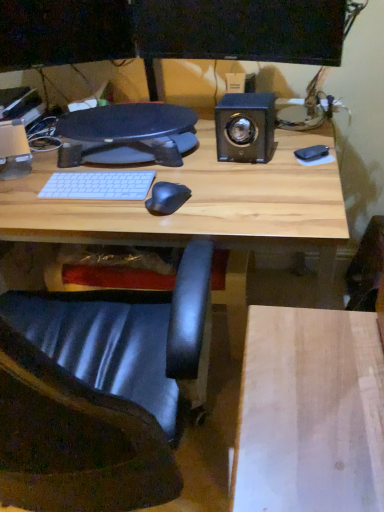
At what (x,y) coordinates should I click in order to perform the action: click on black leather chair at lower left. Please return your answer as a coordinate pair (x, y). Looking at the image, I should click on (99, 394).

What do you see at coordinates (99, 394) in the screenshot? This screenshot has height=512, width=384. I see `black leather chair at lower left` at bounding box center [99, 394].

Consider the image. What is the approximate width of black leather chair at lower left?

27.32 inches.

Locate an element on the screen. metallic black speaker at upper right is located at coordinates (245, 127).

This screenshot has width=384, height=512. Describe the element at coordinates (245, 127) in the screenshot. I see `metallic black speaker at upper right` at that location.

In order to face metallic black speaker at upper right, should I rotate leftwards or rightwards?

A 6.990 degree turn to the right will do.

This screenshot has width=384, height=512. What are the coordinates of `black leather chair at lower left` in the screenshot? It's located at (99, 394).

Is metallic black speaker at upper right to the right of black leather chair at lower left from the viewer's perspective?

Correct, you'll find metallic black speaker at upper right to the right of black leather chair at lower left.

Between metallic black speaker at upper right and black leather chair at lower left, which one is positioned behind?

metallic black speaker at upper right is behind.

Considering the positions of point (274, 101) and point (109, 367), is point (274, 101) closer or farther from the camera than point (109, 367)?

Point (274, 101) is positioned farther from the camera compared to point (109, 367).

From the image's perspective, which is below, metallic black speaker at upper right or black leather chair at lower left?

black leather chair at lower left, from the image's perspective.

In the scene shown: From a real-world perspective, which is physically below, metallic black speaker at upper right or black leather chair at lower left?

black leather chair at lower left.

Is metallic black speaker at upper right wider or thinner than black leather chair at lower left?

Considering their sizes, metallic black speaker at upper right looks slimmer than black leather chair at lower left.

Between metallic black speaker at upper right and black leather chair at lower left, which one has more height?

black leather chair at lower left is taller.

Is metallic black speaker at upper right bigger or smaller than black leather chair at lower left?

Considering their sizes, metallic black speaker at upper right takes up less space than black leather chair at lower left.

Is metallic black speaker at upper right located outside black leather chair at lower left?

metallic black speaker at upper right is positioned outside black leather chair at lower left.

Is metallic black speaker at upper right with black leather chair at lower left?

No, metallic black speaker at upper right is not beside black leather chair at lower left.

Is metallic black speaker at upper right looking in the opposite direction of black leather chair at lower left?

No.

The height and width of the screenshot is (512, 384). I want to click on chair that is below the metallic black speaker at upper right (from the image's perspective), so click(x=99, y=394).

Based on their positions, is black leather chair at lower left located to the left or right of metallic black speaker at upper right?

Clearly, black leather chair at lower left is on the left of metallic black speaker at upper right in the image.

Which is in front, black leather chair at lower left or metallic black speaker at upper right?

Positioned in front is black leather chair at lower left.

Does point (142, 445) appear closer or farther from the camera than point (270, 122)?

Point (142, 445) is closer to the camera than point (270, 122).

From the image's perspective, relative to metallic black speaker at upper right, is black leather chair at lower left above or below?

Based on their image positions, black leather chair at lower left is located beneath metallic black speaker at upper right.

From a real-world perspective, which is physically above, black leather chair at lower left or metallic black speaker at upper right?

metallic black speaker at upper right.

Considering the sizes of objects black leather chair at lower left and metallic black speaker at upper right in the image provided, who is wider, black leather chair at lower left or metallic black speaker at upper right?

Wider between the two is black leather chair at lower left.

Can you confirm if black leather chair at lower left is taller than metallic black speaker at upper right?

Yes, black leather chair at lower left is taller than metallic black speaker at upper right.

Can you confirm if black leather chair at lower left is bigger than metallic black speaker at upper right?

Indeed, black leather chair at lower left has a larger size compared to metallic black speaker at upper right.

Is black leather chair at lower left completely or partially outside of metallic black speaker at upper right?

black leather chair at lower left lies outside metallic black speaker at upper right's area.

Is black leather chair at lower left placed right next to metallic black speaker at upper right?

No, black leather chair at lower left is not beside metallic black speaker at upper right.

Is black leather chair at lower left facing towards metallic black speaker at upper right?

Yes, black leather chair at lower left is facing metallic black speaker at upper right.

How different are the orientations of black leather chair at lower left and metallic black speaker at upper right in degrees?

There is a 170-degree angle between the facing directions of black leather chair at lower left and metallic black speaker at upper right.

This screenshot has height=512, width=384. I want to click on chair on the left side of metallic black speaker at upper right, so click(99, 394).

At what (x,y) coordinates should I click in order to perform the action: click on chair below the metallic black speaker at upper right (from the image's perspective). Please return your answer as a coordinate pair (x, y). Looking at the image, I should click on (99, 394).

This screenshot has height=512, width=384. Find the location of `chair in front of the metallic black speaker at upper right`. chair in front of the metallic black speaker at upper right is located at coordinates (99, 394).